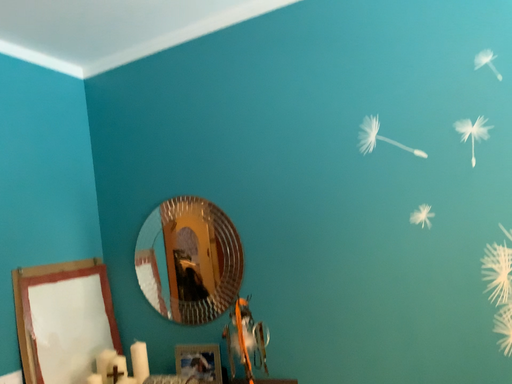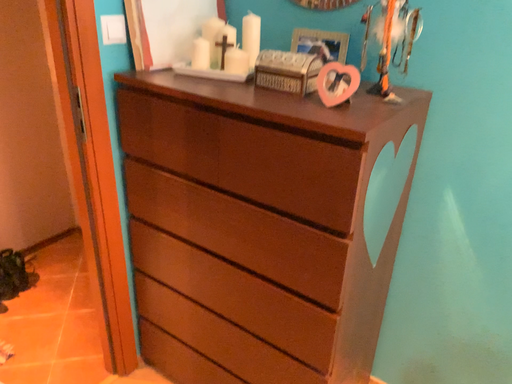
Question: How did the camera likely rotate when shooting the video?

Choices:
 (A) rotated right
 (B) rotated left

Answer: (B)